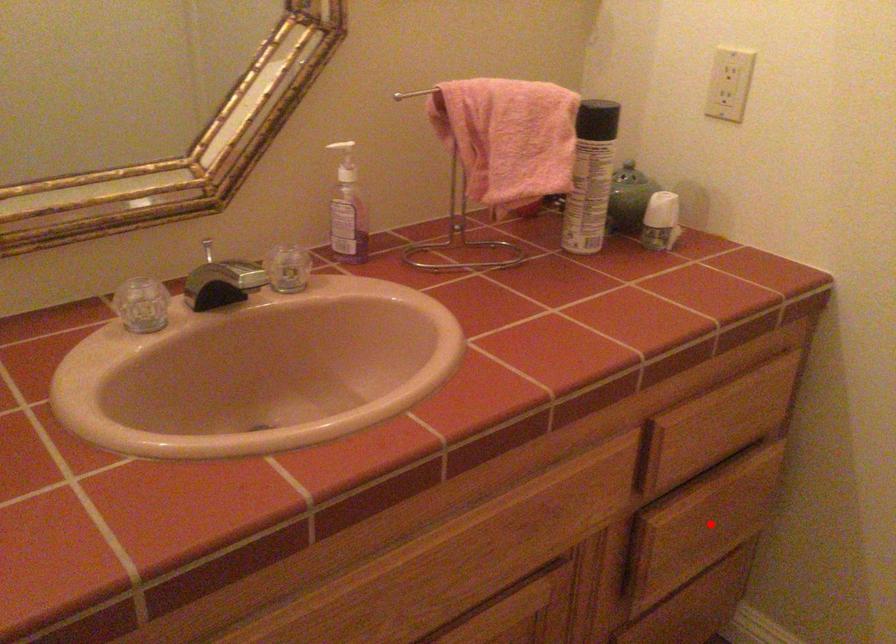
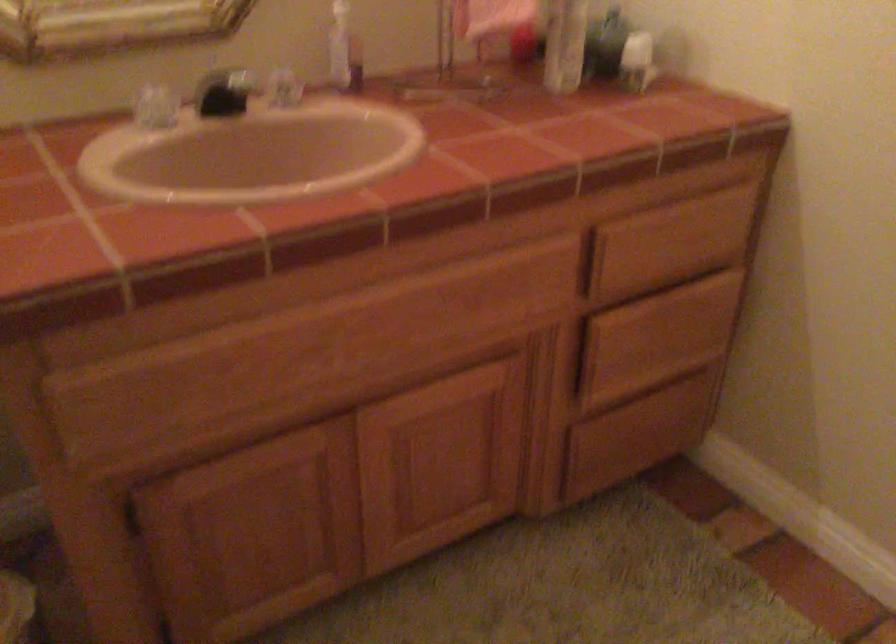
Question: A red point is marked in image1. In image2, is the corresponding 3D point closer to the camera or farther? Reply with the corresponding letter.

Choices:
 (A) The corresponding 3D point is closer.
 (B) The corresponding 3D point is farther.

Answer: (B)